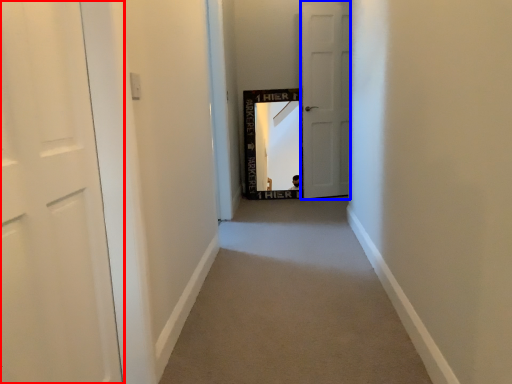
Question: Which object is closer to the camera taking this photo, door (highlighted by a red box) or door (highlighted by a blue box)?

Choices:
 (A) door
 (B) door

Answer: (A)